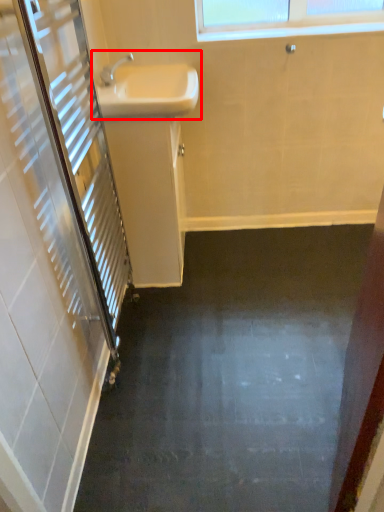
Question: From the image's perspective, where is sink (annotated by the red box) located in relation to sink in the image?

Choices:
 (A) below
 (B) above

Answer: (B)